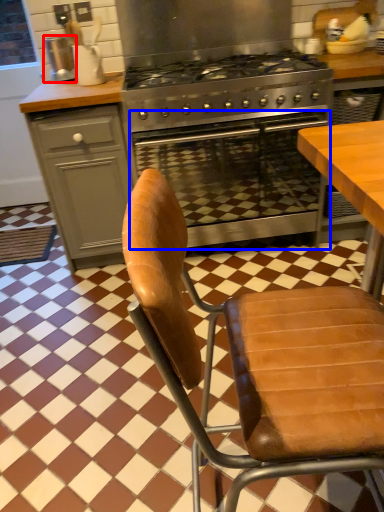
Question: Which object is closer to the camera taking this photo, appliance (highlighted by a red box) or oven (highlighted by a blue box)?

Choices:
 (A) appliance
 (B) oven

Answer: (B)